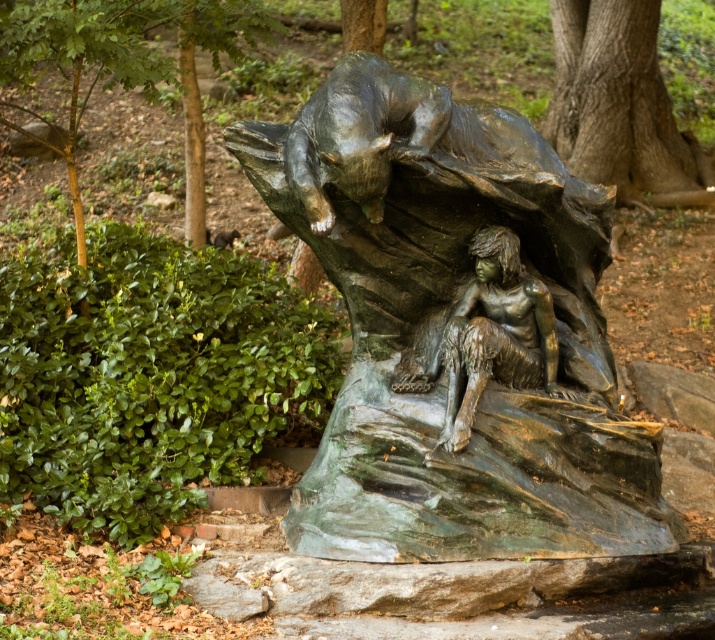
Is smooth brown bark at upper center shorter than bronze figure at center?

Incorrect, smooth brown bark at upper center's height does not fall short of bronze figure at center's.

Between point (654, 13) and point (445, 317), which one is positioned behind?

The point (654, 13) is behind.

The height and width of the screenshot is (640, 715). What are the coordinates of `smooth brown bark at upper center` in the screenshot? It's located at (618, 104).

From the picture: Can you confirm if green patina bronze sculpture at center is positioned above smooth brown bark at upper center?

Actually, green patina bronze sculpture at center is below smooth brown bark at upper center.

At what (x,y) coordinates should I click in order to perform the action: click on green patina bronze sculpture at center. Please return your answer as a coordinate pair (x, y). The image size is (715, 640). Looking at the image, I should click on (455, 332).

The image size is (715, 640). Find the location of `green patina bronze sculpture at center`. green patina bronze sculpture at center is located at coordinates pyautogui.click(x=455, y=332).

Does green patina bronze sculpture at center appear over bronze figure at center?

No, green patina bronze sculpture at center is not above bronze figure at center.

Is the position of green patina bronze sculpture at center more distant than that of bronze figure at center?

No, it is in front of bronze figure at center.

Locate an element on the screen. This screenshot has height=640, width=715. green patina bronze sculpture at center is located at coordinates (455, 332).

Find the location of a particular element. The image size is (715, 640). green patina bronze sculpture at center is located at coordinates (455, 332).